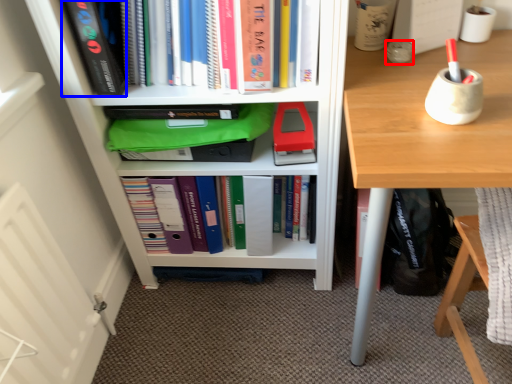
Question: Which object is further to the camera taking this photo, stationery (highlighted by a red box) or paperback book (highlighted by a blue box)?

Choices:
 (A) stationery
 (B) paperback book

Answer: (A)